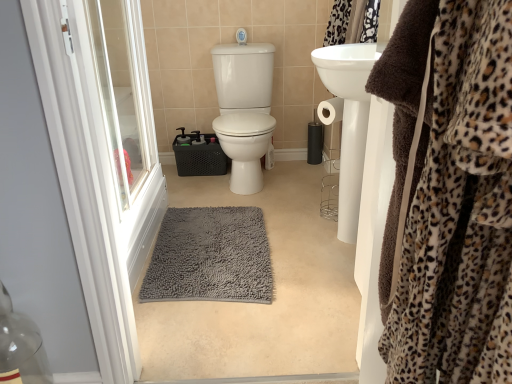
Question: Is white plastic screen door at left at the left side of brown plush robe at right?

Choices:
 (A) yes
 (B) no

Answer: (A)

Question: From the image's perspective, is white plastic screen door at left located beneath brown plush robe at right?

Choices:
 (A) no
 (B) yes

Answer: (A)

Question: Does white plastic screen door at left have a lesser height compared to brown plush robe at right?

Choices:
 (A) yes
 (B) no

Answer: (B)

Question: From the image's perspective, is white plastic screen door at left above brown plush robe at right?

Choices:
 (A) no
 (B) yes

Answer: (B)

Question: Does white plastic screen door at left have a larger size compared to brown plush robe at right?

Choices:
 (A) no
 (B) yes

Answer: (B)

Question: Is white plastic screen door at left positioned behind brown plush robe at right?

Choices:
 (A) yes
 (B) no

Answer: (A)

Question: From the image's perspective, would you say gray shaggy rug at center is shown under white plastic screen door at left?

Choices:
 (A) no
 (B) yes

Answer: (B)

Question: From a real-world perspective, is gray shaggy rug at center on top of white plastic screen door at left?

Choices:
 (A) yes
 (B) no

Answer: (B)

Question: Could you tell me if gray shaggy rug at center is turned towards white plastic screen door at left?

Choices:
 (A) yes
 (B) no

Answer: (B)

Question: Is the surface of gray shaggy rug at center in direct contact with white plastic screen door at left?

Choices:
 (A) no
 (B) yes

Answer: (A)

Question: Does gray shaggy rug at center have a greater width compared to white plastic screen door at left?

Choices:
 (A) no
 (B) yes

Answer: (B)

Question: Can you confirm if gray shaggy rug at center is smaller than white plastic screen door at left?

Choices:
 (A) yes
 (B) no

Answer: (A)

Question: Considering the relative positions of brown plush robe at right and white plastic screen door at left in the image provided, is brown plush robe at right to the right of white plastic screen door at left from the viewer's perspective?

Choices:
 (A) no
 (B) yes

Answer: (B)